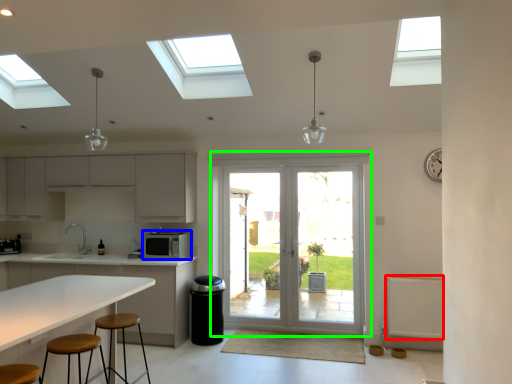
Question: Which object is positioned farthest from radiator (highlighted by a red box)? Select from appliance (highlighted by a blue box) and door (highlighted by a green box).

Choices:
 (A) appliance
 (B) door

Answer: (A)